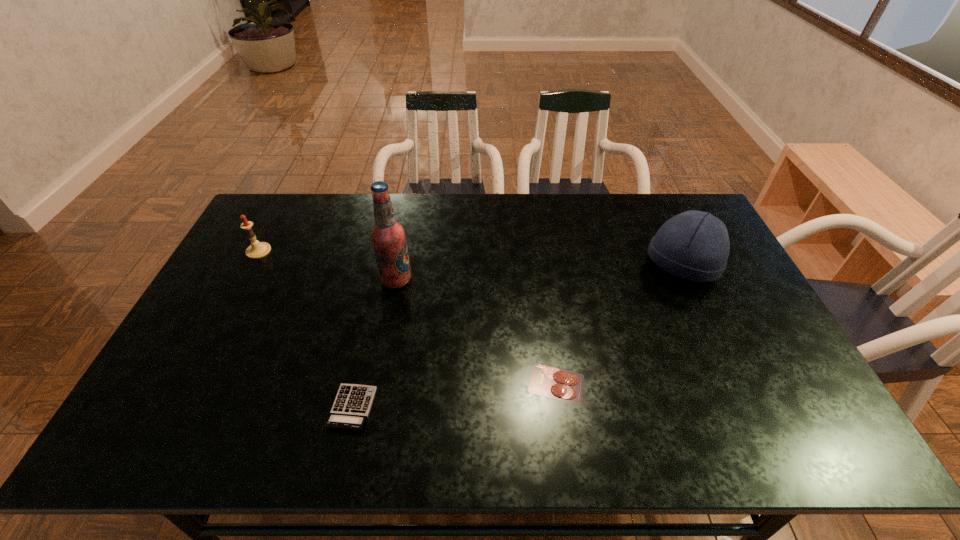
The height and width of the screenshot is (540, 960). I want to click on vacant space positioned on the right of the candle, so click(x=333, y=251).

This screenshot has height=540, width=960. Find the location of `vacant region located on the left of the fourth tallest object`. vacant region located on the left of the fourth tallest object is located at coordinates (240, 408).

What are the coordinates of `vacant space positioned on the right of the shortest object` in the screenshot? It's located at (621, 383).

Find the location of a particular element. object located at the near edge is located at coordinates pyautogui.click(x=351, y=407).

You are a GUI agent. You are given a task and a screenshot of the screen. Output one action in this format:
    pyautogui.click(x=<x>, y=<y>)
    Task: Click on the object that is positioned at the left edge
    The width and height of the screenshot is (960, 540).
    Given the screenshot: What is the action you would take?
    pyautogui.click(x=256, y=250)

Locate an element on the screen. Image resolution: width=960 pixels, height=540 pixels. object situated at the right edge is located at coordinates (694, 245).

In the image, there is a desktop. Identify the location of free space at the far edge. The height and width of the screenshot is (540, 960). (513, 221).

In the image, there is a desktop. Where is `free region at the far left corner`? free region at the far left corner is located at coordinates (270, 213).

The image size is (960, 540). In order to click on free region at the near right corner of the desktop in this screenshot , I will do 821,451.

This screenshot has height=540, width=960. I want to click on vacant point located between the fourth shortest object and the calculator, so click(516, 337).